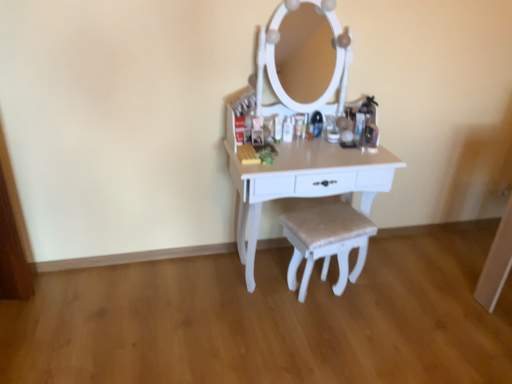
This screenshot has width=512, height=384. Find the location of `vacant area to the right of white painted wood table at center`. vacant area to the right of white painted wood table at center is located at coordinates (416, 287).